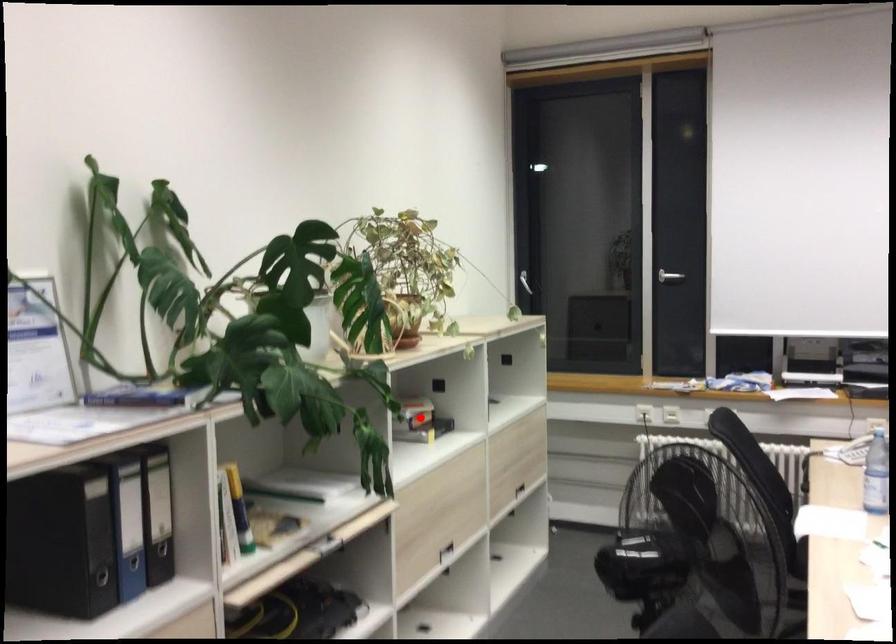
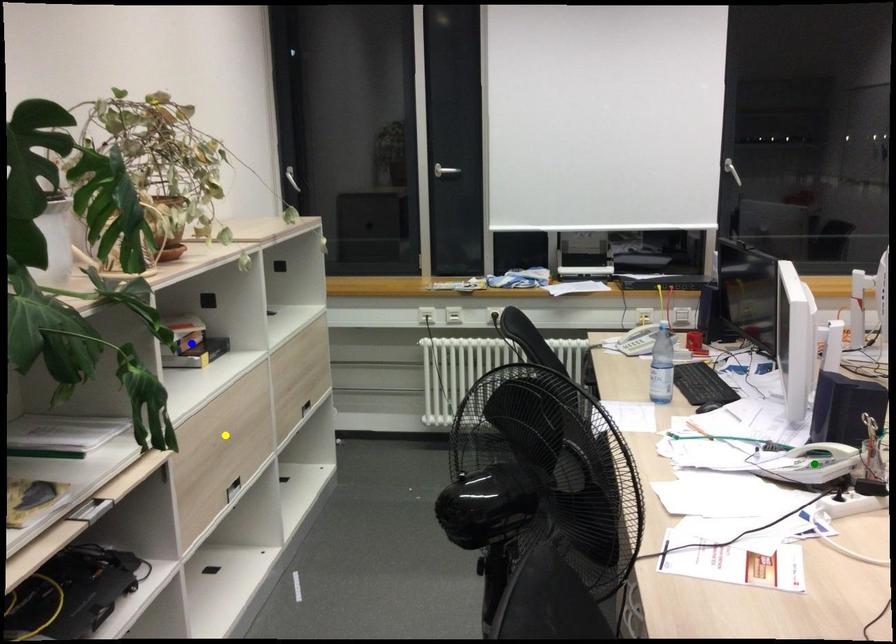
Question: I am providing you with two images of the same scene from different viewpoints. A red point is marked on the first image. You are given multiple points on the second image. Can you choose the point in image 2 that corresponds to the point in image 1?

Choices:
 (A) green point
 (B) blue point
 (C) yellow point

Answer: (B)